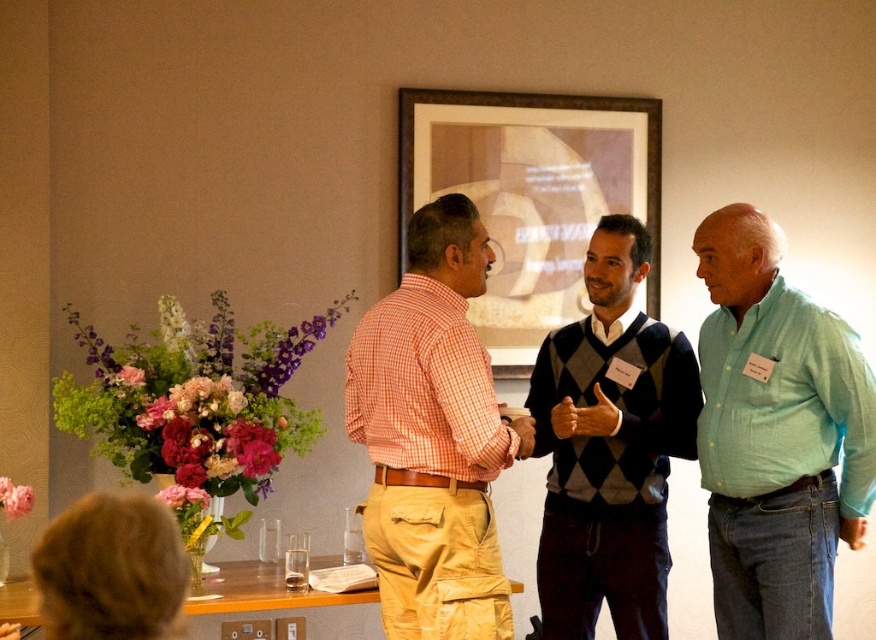
You are standing at the event and want to reach the framed picture on the wall. The point you need to reach is labeled as point (562, 276). Can you estimate whether you can reach it without any assistance?

The distance between point (562, 276) and the viewer is 3.79 meters. Since the average person can reach about 2 meters, you would need assistance to reach the framed picture at point (562, 276).

You are at a social event and see the orange checkered shirt at center and the wooden framed picture at center. Which object is closer to the ground?

The orange checkered shirt at center is closer to the ground because it is positioned under the wooden framed picture at center.

You are at an event and want to take a photo of both the orange checkered shirt at center and the wooden framed picture at center. Which one should you focus on first if you want to capture both in the same frame?

The orange checkered shirt at center is taller than the wooden framed picture at center, so you should focus on the orange checkered shirt at center first to ensure both are in the frame.